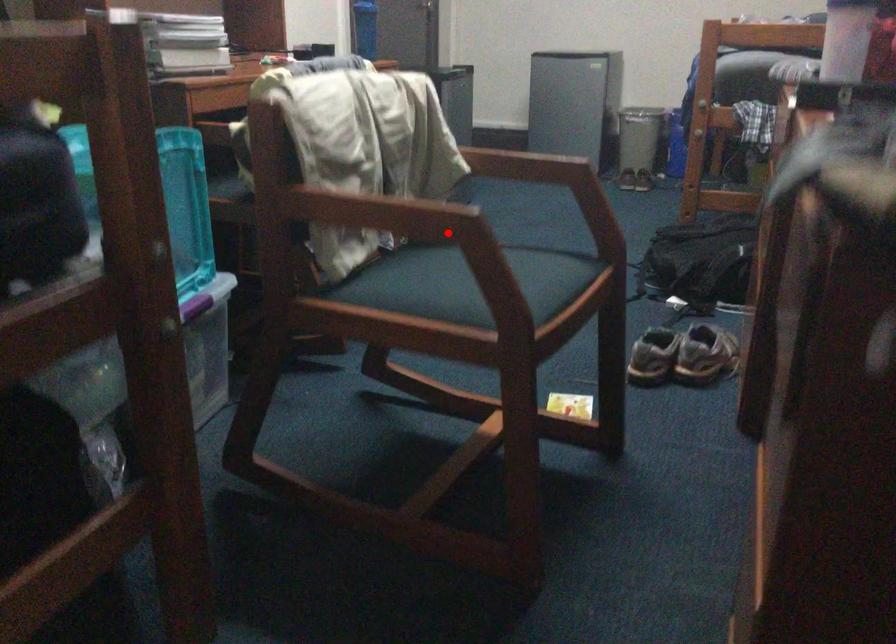
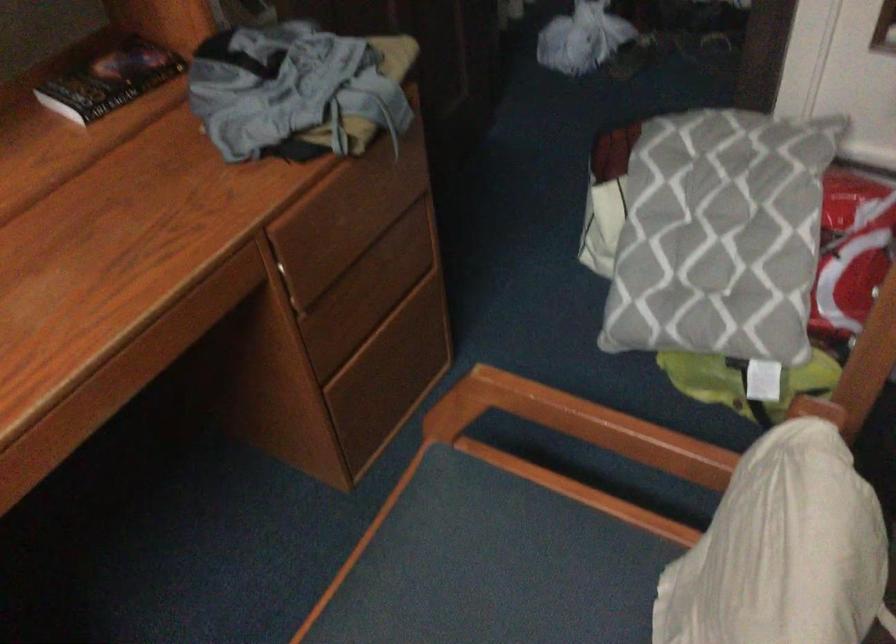
Locate, in the second image, the point that corresponds to the highlighted location in the first image.

(579, 424)